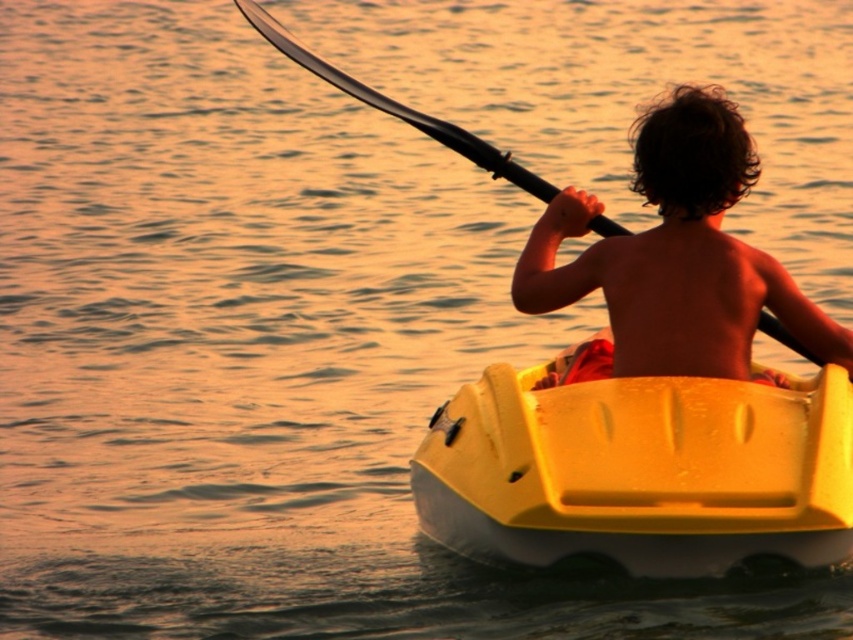
Question: From the image, what is the correct spatial relationship of yellow plastic boat at center in relation to shiny brown hair at center?

Choices:
 (A) left
 (B) right

Answer: (A)

Question: Does yellow plastic boat at center come behind shiny brown hair at center?

Choices:
 (A) yes
 (B) no

Answer: (B)

Question: Does yellow plastic boat at center have a larger size compared to shiny brown hair at center?

Choices:
 (A) no
 (B) yes

Answer: (A)

Question: Which point appears farthest from the camera in this image?

Choices:
 (A) (830, 522)
 (B) (631, 372)

Answer: (B)

Question: Which of the following is the farthest from the observer?

Choices:
 (A) (689, 314)
 (B) (506, 380)

Answer: (A)